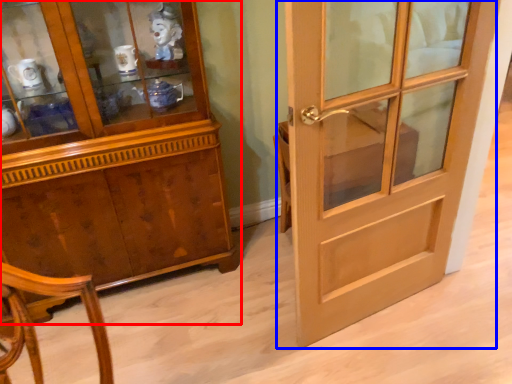
Question: Which of the following is the farthest to the observer, cabinetry (highlighted by a red box) or door (highlighted by a blue box)?

Choices:
 (A) cabinetry
 (B) door

Answer: (A)